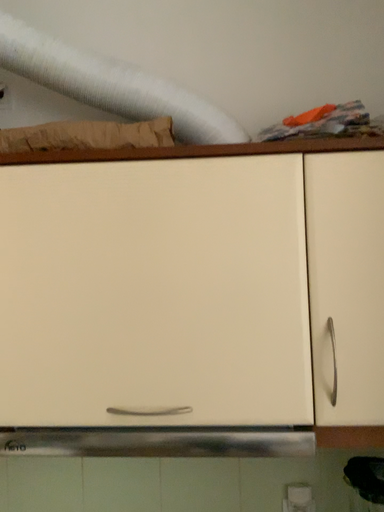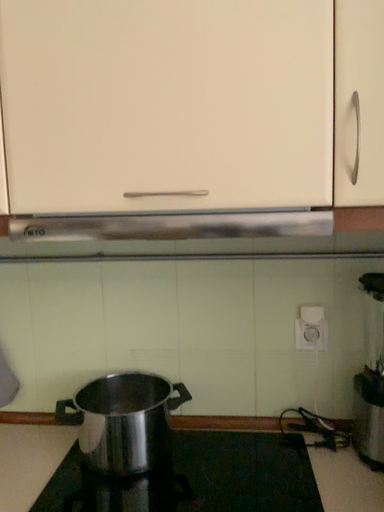
Question: How did the camera likely rotate when shooting the video?

Choices:
 (A) rotated upward
 (B) rotated downward

Answer: (B)